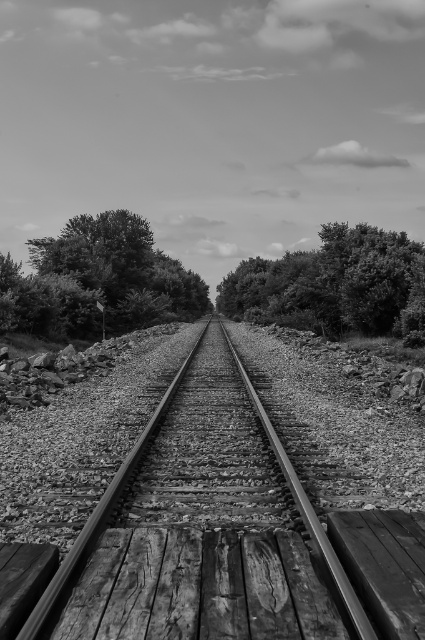
Question: Which of these objects is positioned farthest from the thick green foliage at center?

Choices:
 (A) green leafy tree at center
 (B) metal/rough train track at center

Answer: (B)

Question: Where is metal/rough train track at center located in relation to thick green foliage at center in the image?

Choices:
 (A) left
 (B) right

Answer: (A)

Question: Which object is the closest to the green leafy tree at center?

Choices:
 (A) thick green foliage at center
 (B) metal/rough train track at center

Answer: (A)

Question: Can you confirm if metal/rough train track at center is thinner than thick green foliage at center?

Choices:
 (A) no
 (B) yes

Answer: (B)

Question: Can you confirm if metal/rough train track at center is smaller than green leafy tree at center?

Choices:
 (A) no
 (B) yes

Answer: (B)

Question: Which object is the closest to the green leafy tree at center?

Choices:
 (A) metal/rough train track at center
 (B) thick green foliage at center

Answer: (B)